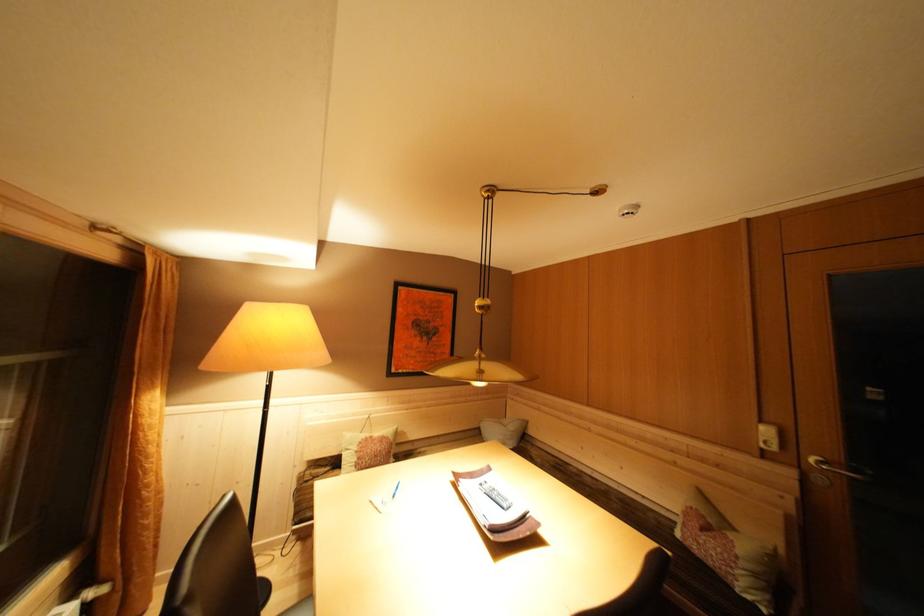
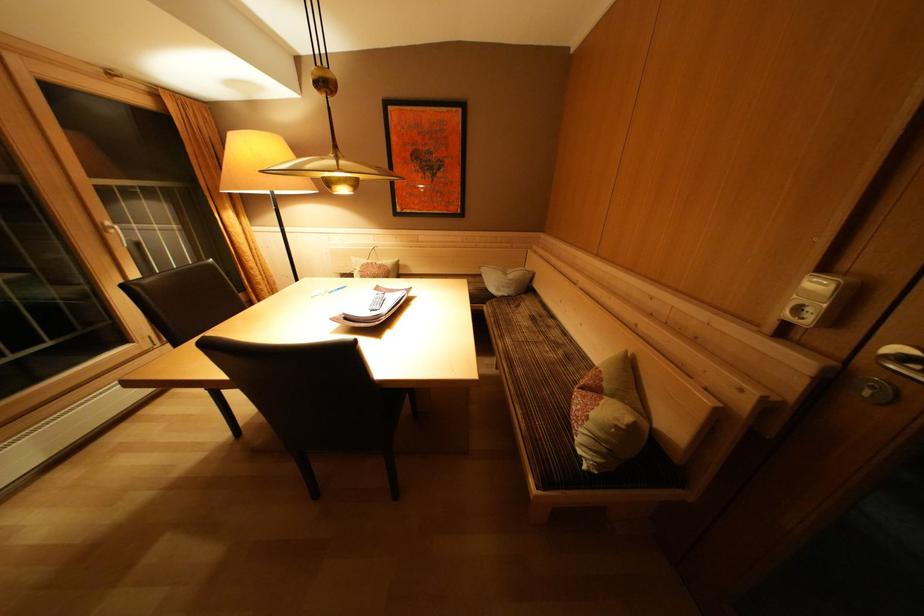
The point at (782, 454) is marked in the first image. Where is the corresponding point in the second image?

(815, 326)